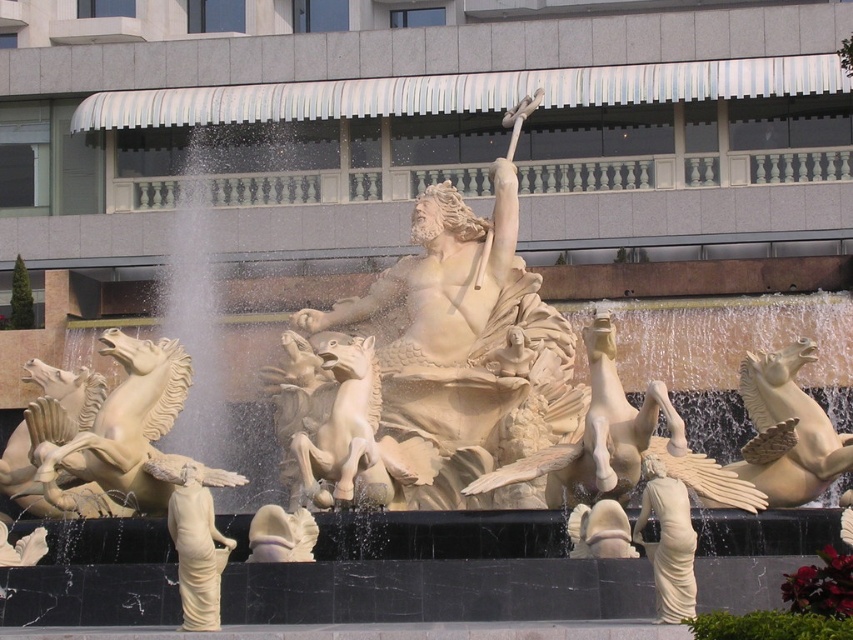
Question: Which of the following is the farthest from the observer?

Choices:
 (A) (189, 509)
 (B) (390, 456)

Answer: (B)

Question: Which point is farther from the camera taking this photo?

Choices:
 (A) (492, 406)
 (B) (213, 484)

Answer: (A)

Question: Which object is the farthest from the beige stone horse at left?

Choices:
 (A) white marble statue at center
 (B) matte beige statue at lower center

Answer: (A)

Question: Does beige stone horse at left appear on the left side of matte beige statue at lower center?

Choices:
 (A) yes
 (B) no

Answer: (A)

Question: In this image, where is white marble statue at center located relative to matte beige statue at lower center?

Choices:
 (A) above
 (B) below

Answer: (A)

Question: Can you confirm if white marble statue at center is smaller than matte beige statue at lower center?

Choices:
 (A) no
 (B) yes

Answer: (A)